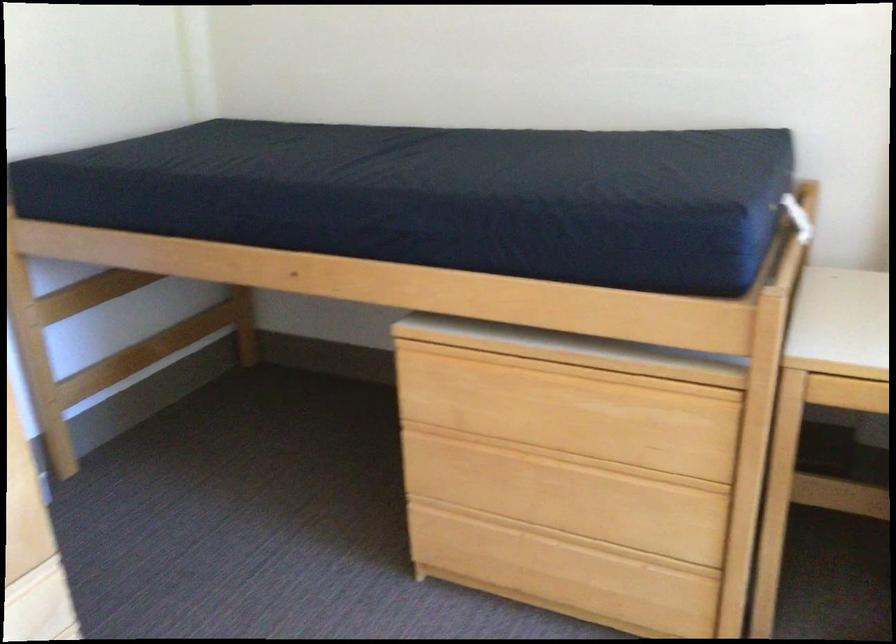
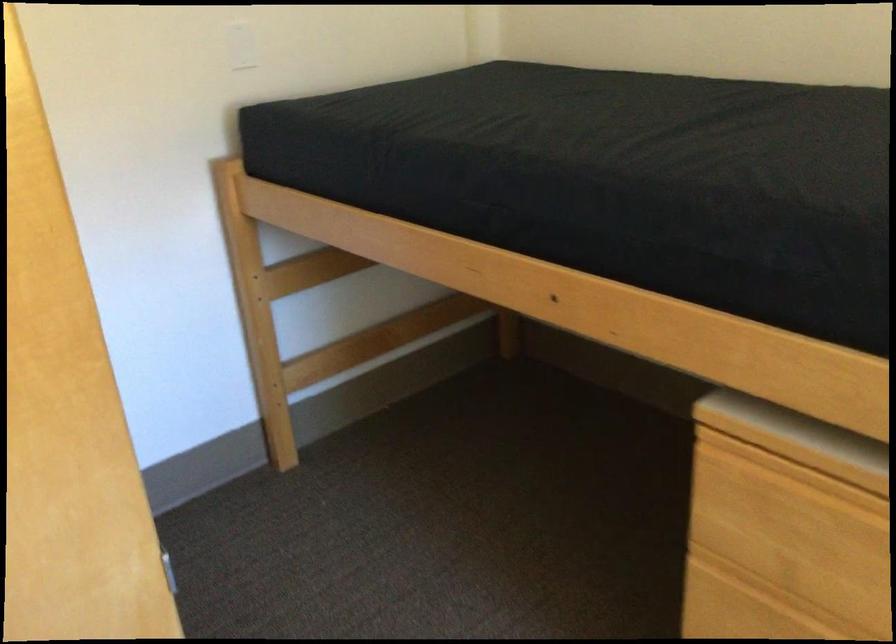
Where in the second image is the point corresponding to point (90, 386) from the first image?

(319, 368)